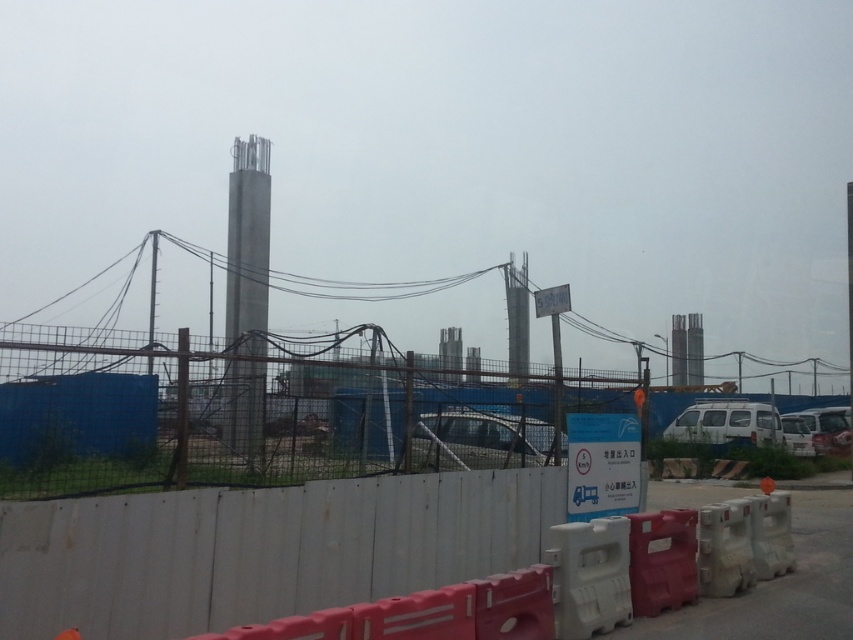
Does blue mesh fence at lower left lie in front of silver metallic car at center?

That is True.

Who is positioned more to the left, blue mesh fence at lower left or silver metallic car at center?

silver metallic car at center

What do you see at coordinates (236, 412) in the screenshot? This screenshot has width=853, height=640. I see `blue mesh fence at lower left` at bounding box center [236, 412].

The image size is (853, 640). I want to click on blue mesh fence at lower left, so 236,412.